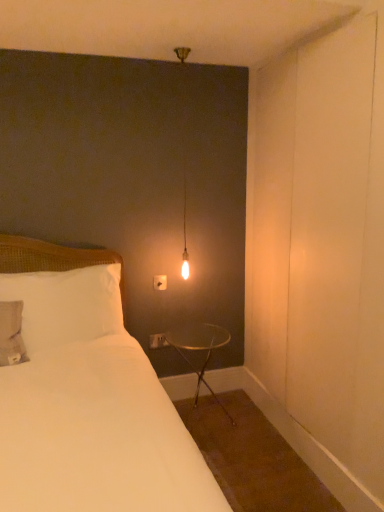
Question: From a real-world perspective, relative to white plastic electric outlet at upper center, is white soft pillow at left vertically above or below?

Choices:
 (A) below
 (B) above

Answer: (B)

Question: Does point (74, 280) appear closer or farther from the camera than point (158, 279)?

Choices:
 (A) farther
 (B) closer

Answer: (B)

Question: Which is nearer to the white fabric bed at left?

Choices:
 (A) white plastic electric outlet at upper center
 (B) clear glass table at lower right
 (C) white soft pillow at left
 (D) matte glass bulb at upper center

Answer: (C)

Question: Which is farther from the white fabric bed at left?

Choices:
 (A) clear glass table at lower right
 (B) white plastic electric outlet at upper center
 (C) white soft pillow at left
 (D) matte glass bulb at upper center

Answer: (D)